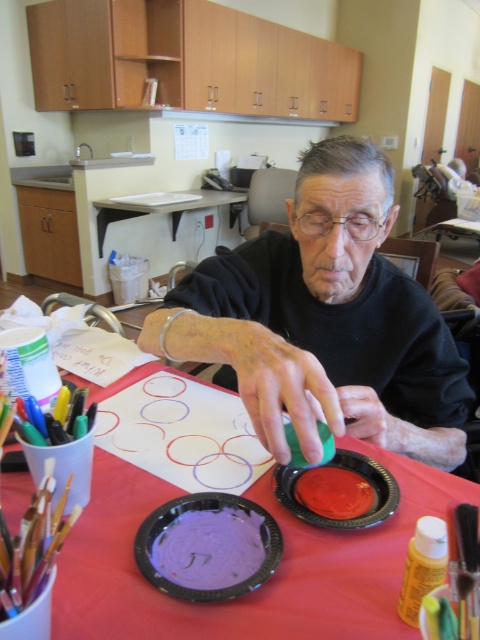
Between matte black shirt at center and purple matte paper plate at center, which one has more height?

Standing taller between the two is matte black shirt at center.

Is matte black shirt at center to the right of purple matte paper plate at center from the viewer's perspective?

Yes, matte black shirt at center is to the right of purple matte paper plate at center.

Find the location of a particular element. matte black shirt at center is located at coordinates (324, 321).

Can you confirm if red paper table at center is positioned to the right of purple matte paper plate at center?

In fact, red paper table at center is to the left of purple matte paper plate at center.

Can you confirm if red paper table at center is positioned above purple matte paper plate at center?

Yes, red paper table at center is above purple matte paper plate at center.

Where is `red paper table at center`? The width and height of the screenshot is (480, 640). red paper table at center is located at coordinates (257, 588).

Identify the location of red paper table at center. This screenshot has height=640, width=480. (257, 588).

Who is more forward, [105,536] or [278,480]?

Point [105,536] is more forward.

Which of these two, red paper table at center or shiny plastic plate at center, stands shorter?

Standing shorter between the two is shiny plastic plate at center.

At what (x,y) coordinates should I click in order to perform the action: click on red paper table at center. Please return your answer as a coordinate pair (x, y). The height and width of the screenshot is (640, 480). Looking at the image, I should click on click(257, 588).

Locate an element on the screen. red paper table at center is located at coordinates (257, 588).